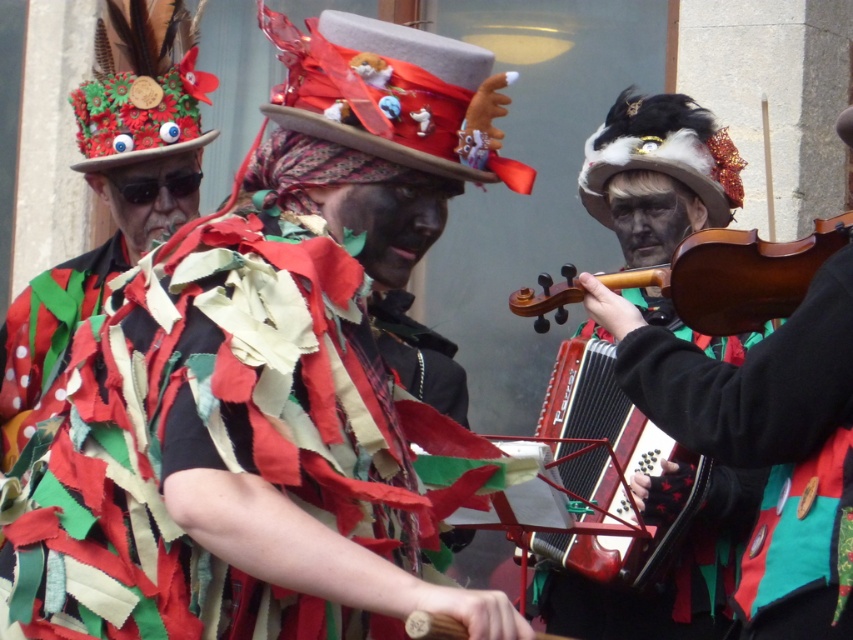
Question: Which point is closer to the camera?

Choices:
 (A) (109, 540)
 (B) (621, 509)
 (C) (741, 285)

Answer: (A)

Question: Does multicolored fabric strips at center have a lesser width compared to wooden accordion at center?

Choices:
 (A) yes
 (B) no

Answer: (B)

Question: Does wooden accordion at center appear on the right side of brown wooden violin at center?

Choices:
 (A) yes
 (B) no

Answer: (B)

Question: Where is wooden accordion at center located in relation to brown wooden violin at center in the image?

Choices:
 (A) left
 (B) right

Answer: (A)

Question: Which of these objects is positioned farthest from the brown wooden violin at center?

Choices:
 (A) multicolored fabric strips at center
 (B) wooden accordion at center

Answer: (A)

Question: Which point is farther to the camera?

Choices:
 (A) brown wooden violin at center
 (B) multicolored fabric strips at center
 (C) wooden accordion at center

Answer: (C)